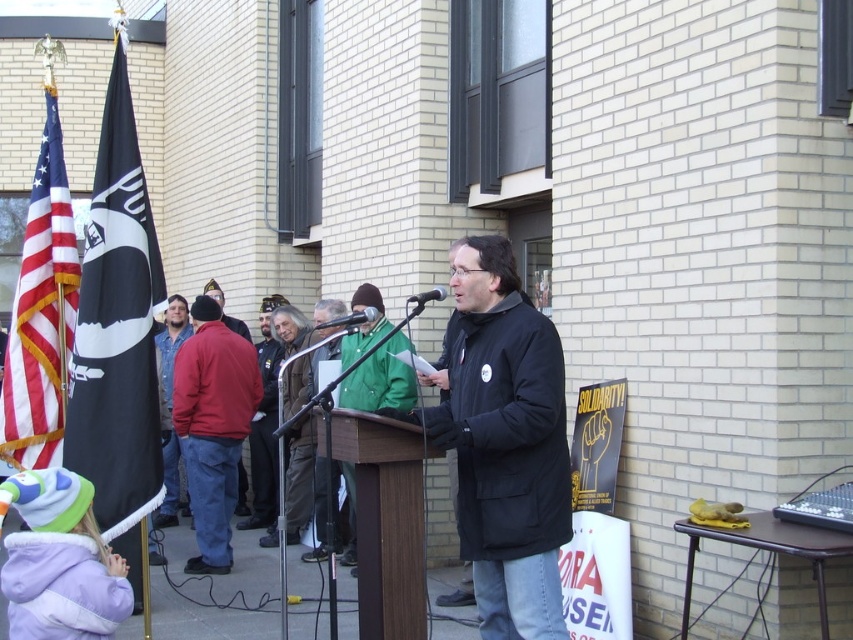
Question: Which object is farther from the camera taking this photo?

Choices:
 (A) red cotton jacket at center
 (B) green fabric jacket at center
 (C) black matte jacket at center

Answer: (B)

Question: In this image, where is green matte jacket at center located relative to metallic silver microphone at center?

Choices:
 (A) above
 (B) below

Answer: (B)

Question: Is black matte jacket at center further to the viewer compared to metallic silver microphone at center?

Choices:
 (A) no
 (B) yes

Answer: (A)

Question: Is black matte jacket at center to the left of black metallic microphone at center from the viewer's perspective?

Choices:
 (A) no
 (B) yes

Answer: (A)

Question: Which point is closer to the camera taking this photo?

Choices:
 (A) pyautogui.click(x=254, y=460)
 (B) pyautogui.click(x=340, y=344)
 (C) pyautogui.click(x=187, y=348)

Answer: (C)

Question: Which object is positioned closest to the black matte jacket at center?

Choices:
 (A) black fabric flag at left
 (B) american flag at left
 (C) red cotton jacket at center

Answer: (A)